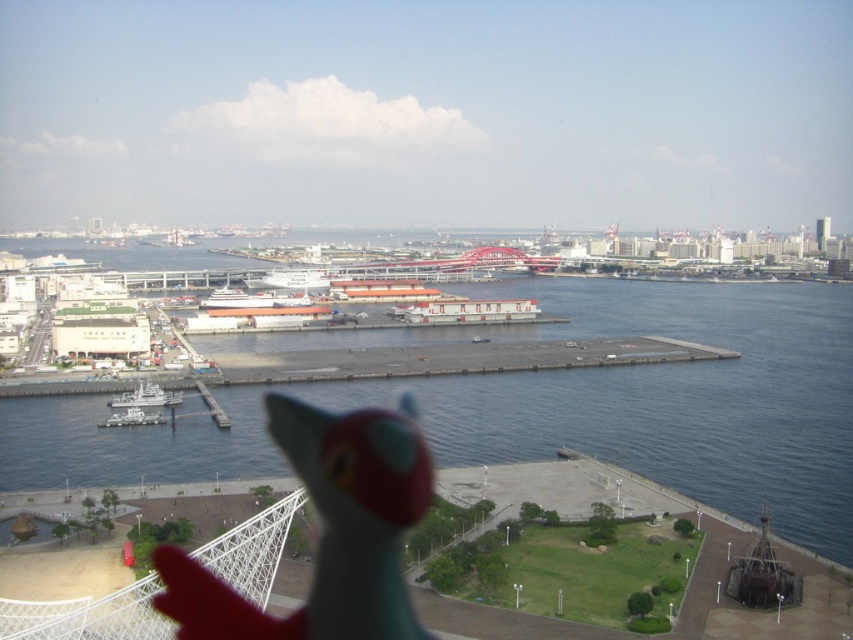
Question: Which object is positioned closest to the white matte ship at center?

Choices:
 (A) white glossy ship at lower left
 (B) white matte ship at lower left
 (C) matte plastic toy at lower center
 (D) blue water at center

Answer: (D)

Question: Which point is closer to the camera taking this photo?

Choices:
 (A) (112, 426)
 (B) (392, 502)

Answer: (B)

Question: Does matte plastic toy at lower center have a larger size compared to white matte ship at center?

Choices:
 (A) no
 (B) yes

Answer: (A)

Question: Which point is farther to the camera?

Choices:
 (A) white glossy ship at lower left
 (B) matte plastic toy at lower center

Answer: (A)

Question: Is blue water at center wider than white matte ship at lower left?

Choices:
 (A) yes
 (B) no

Answer: (A)

Question: Is white glossy ship at lower left positioned before white matte ship at lower left?

Choices:
 (A) no
 (B) yes

Answer: (A)